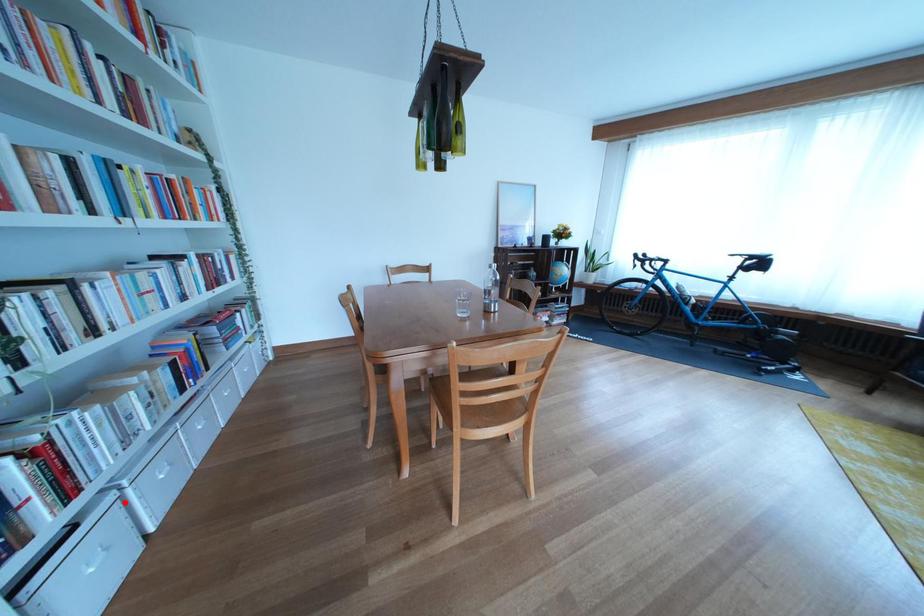
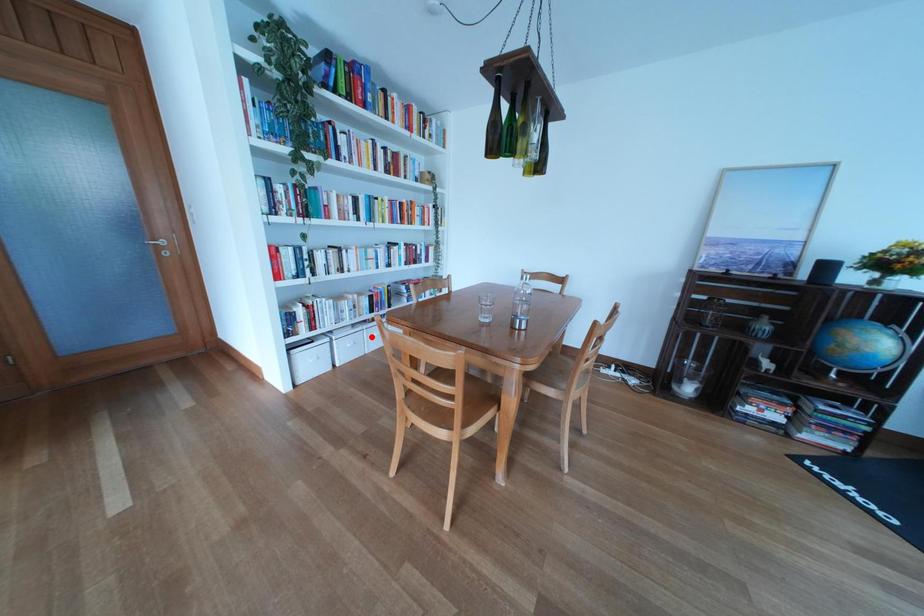
From the picture: I am providing you with two images of the same scene from different viewpoints. A red point is marked on the first image and another point is marked on the second image. Is the red point in image1 aligned with the point shown in image2?

No